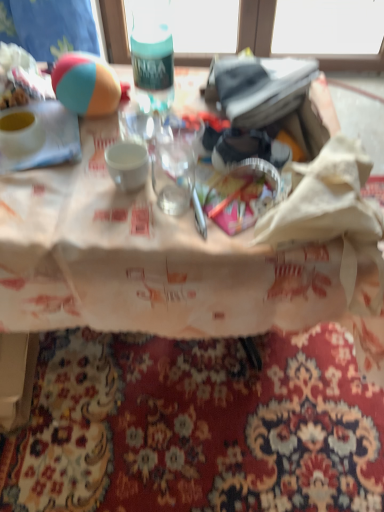
Identify the location of free spot in front of matte white bowl at upper left. (40, 184).